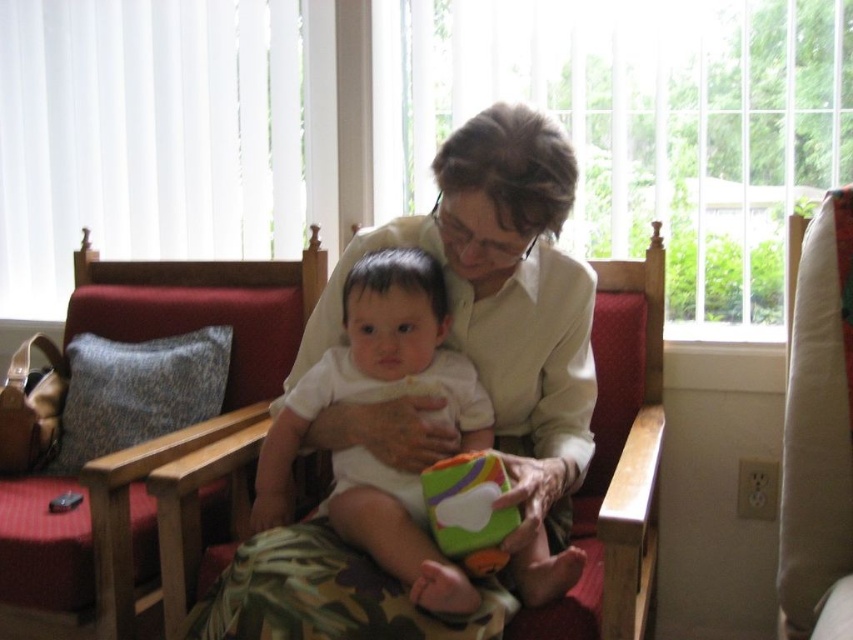
Question: Is beige fabric rocking chair at right positioned behind matte green plush cube at center?

Choices:
 (A) yes
 (B) no

Answer: (A)

Question: Which point is farther from the camera taking this photo?

Choices:
 (A) (489, 474)
 (B) (840, 476)
 (C) (109, 470)

Answer: (C)

Question: Among these points, which one is nearest to the camera?

Choices:
 (A) (144, 332)
 (B) (492, 483)

Answer: (B)

Question: From the image, what is the correct spatial relationship of red fabric rocking chair at left in relation to beige fabric rocking chair at right?

Choices:
 (A) right
 (B) left

Answer: (B)

Question: Can you confirm if red fabric rocking chair at left is positioned to the right of white matte onesie at center?

Choices:
 (A) no
 (B) yes

Answer: (A)

Question: Which point appears closest to the camera in this image?

Choices:
 (A) pos(849,278)
 (B) pos(421,372)

Answer: (A)